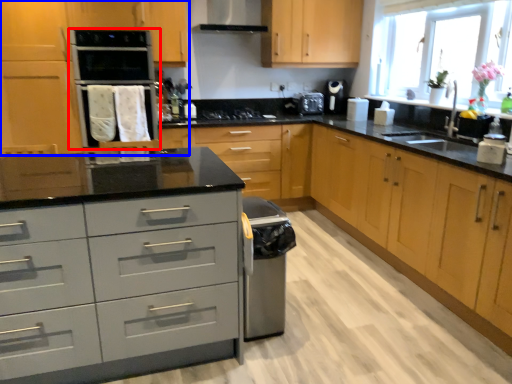
Question: Among these objects, which one is nearest to the camera, home appliance (highlighted by a red box) or cabinetry (highlighted by a blue box)?

Choices:
 (A) home appliance
 (B) cabinetry

Answer: (B)